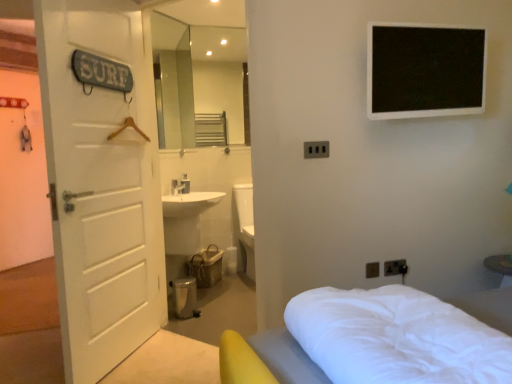
Question: Are white soft bed at lower right and black plastic electric outlet at center, the first electric outlet in the front-to-back sequence, making contact?

Choices:
 (A) yes
 (B) no

Answer: (B)

Question: Would you consider white soft bed at lower right to be distant from black plastic electric outlet at center, the 3th electric outlet positioned from the bottom?

Choices:
 (A) yes
 (B) no

Answer: (A)

Question: Is white soft bed at lower right thinner than black plastic electric outlet at center, arranged as the first electric outlet when viewed from the left?

Choices:
 (A) no
 (B) yes

Answer: (A)

Question: Does white soft bed at lower right come behind black plastic electric outlet at center, which appears as the 1th electric outlet when viewed from the top?

Choices:
 (A) no
 (B) yes

Answer: (A)

Question: From the image's perspective, is white soft bed at lower right beneath black plastic electric outlet at center, the 3th electric outlet positioned from the bottom?

Choices:
 (A) no
 (B) yes

Answer: (B)

Question: From the image's perspective, relative to white wooden door at left, is matte black electric outlet at lower right, placed as the 2th electric outlet when sorted from back to front, above or below?

Choices:
 (A) above
 (B) below

Answer: (B)

Question: In terms of width, does matte black electric outlet at lower right, which is counted as the 1th electric outlet, starting from the bottom, look wider or thinner when compared to white wooden door at left?

Choices:
 (A) wide
 (B) thin

Answer: (B)

Question: Choose the correct answer: Is matte black electric outlet at lower right, acting as the 2th electric outlet starting from the front, inside white wooden door at left or outside it?

Choices:
 (A) outside
 (B) inside

Answer: (A)

Question: Looking at the image, does matte black electric outlet at lower right, which is counted as the 1th electric outlet, starting from the bottom, seem bigger or smaller compared to white wooden door at left?

Choices:
 (A) big
 (B) small

Answer: (B)

Question: Looking at the image, does black plastic electric outlet at center, which appears as the 1th electric outlet when viewed from the top, seem bigger or smaller compared to white wooden door at left?

Choices:
 (A) big
 (B) small

Answer: (B)

Question: Is black plastic electric outlet at center, arranged as the first electric outlet when viewed from the left, in front of or behind white wooden door at left in the image?

Choices:
 (A) behind
 (B) front

Answer: (A)

Question: Visually, is black plastic electric outlet at center, which ranks as the third electric outlet in right-to-left order, positioned to the left or to the right of white wooden door at left?

Choices:
 (A) right
 (B) left

Answer: (A)

Question: Which is correct: black plastic electric outlet at center, arranged as the first electric outlet when viewed from the left, is inside white wooden door at left, or outside of it?

Choices:
 (A) inside
 (B) outside

Answer: (B)

Question: Relative to black plastic electric outlet at center, which ranks as the third electric outlet in right-to-left order, is white wooden door at left in front or behind?

Choices:
 (A) front
 (B) behind

Answer: (A)

Question: From the image's perspective, is white wooden door at left located above or below black plastic electric outlet at center, marked as the third electric outlet in a back-to-front arrangement?

Choices:
 (A) below
 (B) above

Answer: (A)